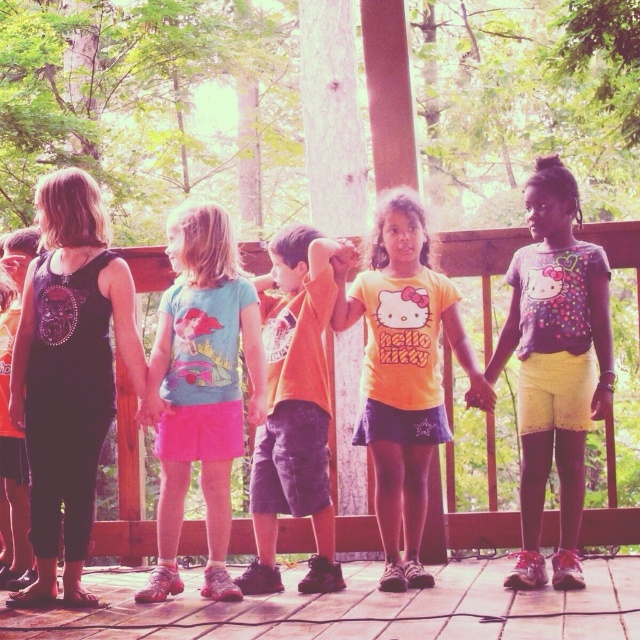
Question: Is yellow matte shirt at center further to the viewer compared to orange cotton shirt at center?

Choices:
 (A) no
 (B) yes

Answer: (A)

Question: Which point is farther to the camera?

Choices:
 (A) (10, 490)
 (B) (525, 230)
 (C) (372, 413)

Answer: (B)

Question: Which object is closer to the camera taking this photo?

Choices:
 (A) orange cotton shirt at center
 (B) purple fabric shirt at right
 (C) wooden deck at center
 (D) black matte tank top at left

Answer: (C)

Question: From the image, what is the correct spatial relationship of purple fabric shirt at right in relation to matte black tank top at left?

Choices:
 (A) below
 (B) above

Answer: (B)

Question: Can you confirm if brown wooden deck at lower center is positioned above orange cotton shirt at center?

Choices:
 (A) no
 (B) yes

Answer: (A)

Question: Considering the real-world distances, which object is farthest from the matte black tank top at left?

Choices:
 (A) orange cotton shirt at center
 (B) brown wooden deck at lower center
 (C) matte pink skirt at center
 (D) black matte tank top at left

Answer: (B)